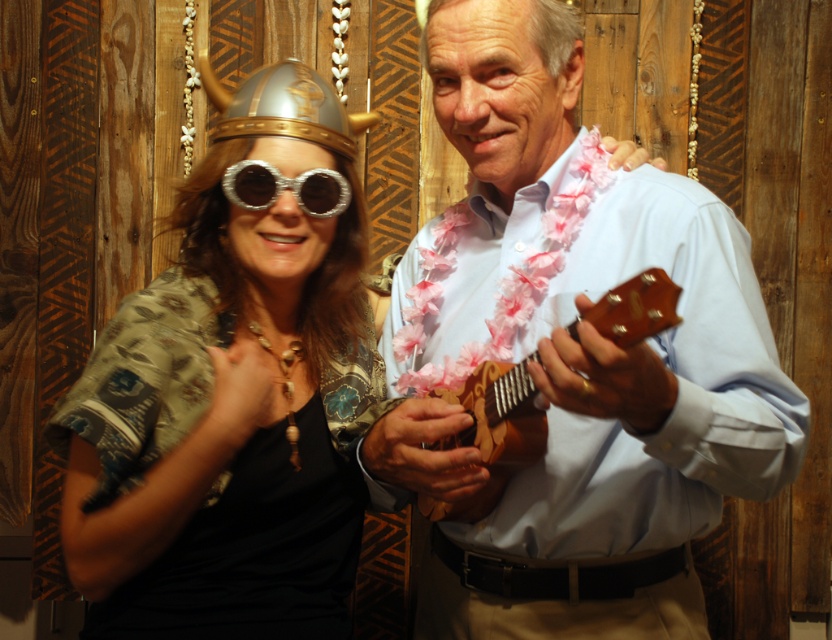
Question: Does silver metallic helmet at upper left have a greater width compared to silver reflective goggles at center?

Choices:
 (A) yes
 (B) no

Answer: (A)

Question: Is shiny metallic helmet at center wider than wooden ukulele at center?

Choices:
 (A) yes
 (B) no

Answer: (A)

Question: Can you confirm if wooden ukulele at center is thinner than silver reflective goggles at center?

Choices:
 (A) no
 (B) yes

Answer: (A)

Question: Which object appears farthest from the camera in this image?

Choices:
 (A) wooden ukulele at center
 (B) silver metallic helmet at upper left
 (C) shiny metallic helmet at center

Answer: (B)

Question: Estimate the real-world distances between objects in this image. Which object is farther from the shiny metallic helmet at center?

Choices:
 (A) silver metallic helmet at upper left
 (B) silver reflective goggles at center
 (C) light blue shirt at center

Answer: (C)

Question: Which point is closer to the camera?

Choices:
 (A) silver reflective goggles at center
 (B) shiny metallic helmet at center

Answer: (B)